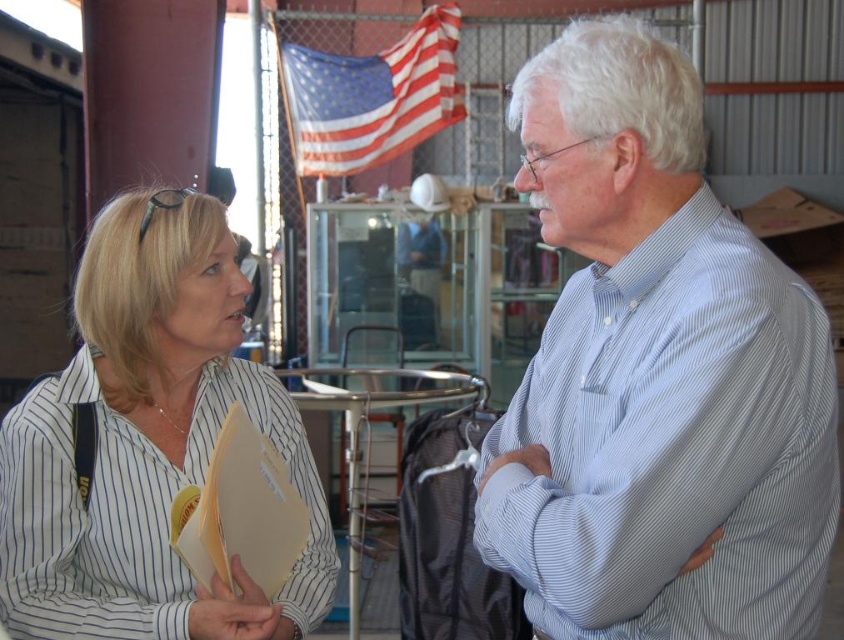
You are a photographer trying to capture a portrait of the white striped shirt at left and the american flag at upper center in the background. Based on their sizes in the image, which one should appear smaller in the final photo?

The white striped shirt at left should appear smaller in the final photo because it is not as tall as the american flag at upper center, meaning it is closer to the camera and thus would be larger if it were farther away. Wait, actually, the description says the shirt is not as tall as the flag, so in the photo, the flag is taller, so the shirt would be smaller. Hmm, maybe I need to clarify. Since the shirt is not as tall as the flag in the image, the flag is taller, so the shirt would be smaller in the pht

You are organizing a charity event and need to determine which shirt to display first based on size. Which of the two shirts, the light blue striped shirt at center or the white striped shirt at left, should be placed first if you want to arrange them from largest to smallest?

The light blue striped shirt at center should be placed first because it has a larger size compared to the white striped shirt at left.

Based on the coordinates provided, which object in the scene corresponds to the point labeled as point (656,376)?

The point (656,376) corresponds to the light blue striped shirt at center.